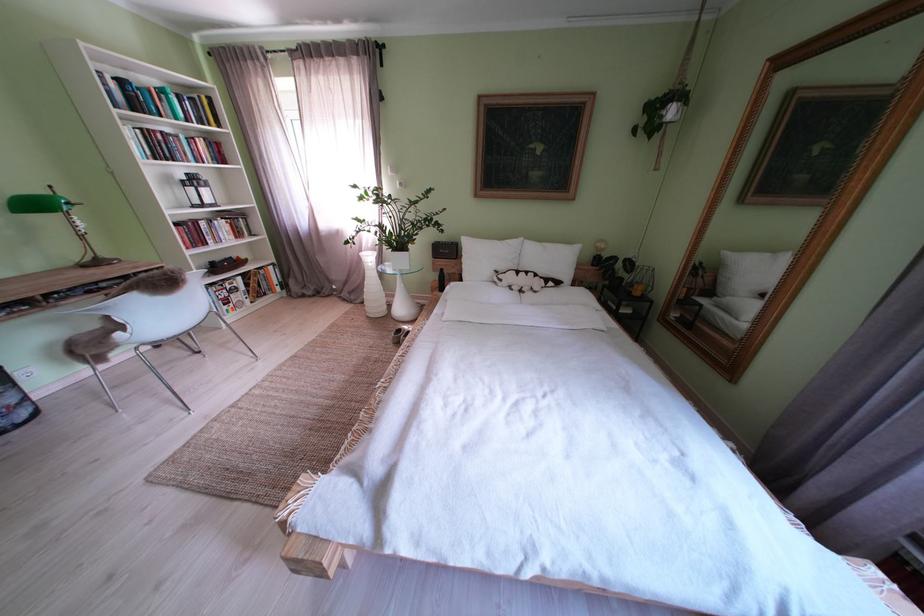
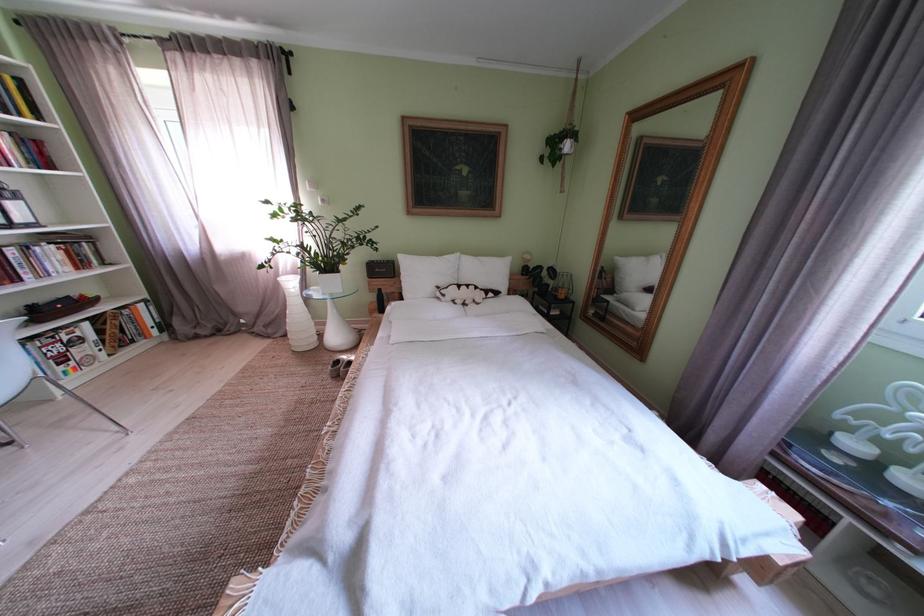
Locate, in the second image, the point that corresponds to [210,110] in the first image.

(9, 92)